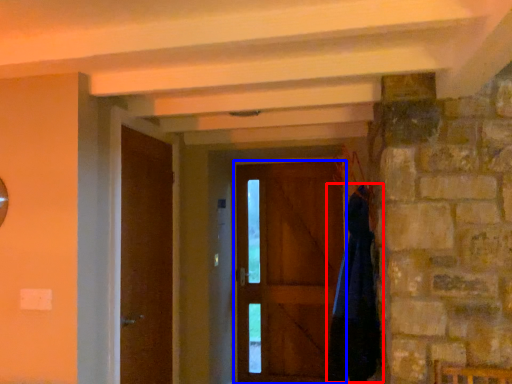
Question: Which object appears farthest to the camera in this image, cloak (highlighted by a red box) or door (highlighted by a blue box)?

Choices:
 (A) cloak
 (B) door

Answer: (B)